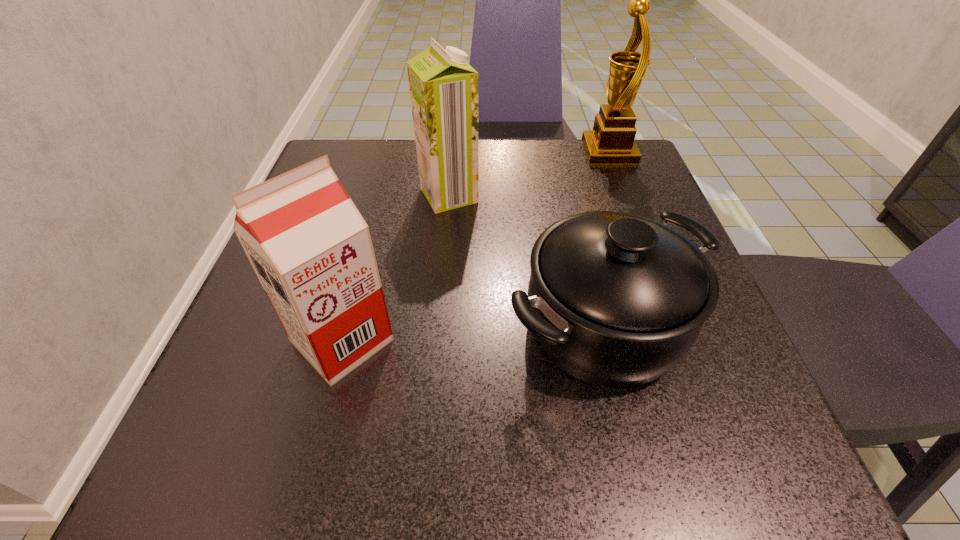
At what (x,y) coordinates should I click in order to perform the action: click on free space at the left edge. Please return your answer as a coordinate pair (x, y). Looking at the image, I should click on (229, 361).

The height and width of the screenshot is (540, 960). In the image, there is a desktop. Find the location of `free space at the near left corner`. free space at the near left corner is located at coordinates (289, 477).

What are the coordinates of `vacant space at the far right corner of the desktop` in the screenshot? It's located at (568, 143).

Where is `vacant space at the near right corner of the desktop`? The height and width of the screenshot is (540, 960). vacant space at the near right corner of the desktop is located at coordinates (710, 472).

You are a GUI agent. You are given a task and a screenshot of the screen. Output one action in this format:
    pyautogui.click(x=<x>, y=<y>)
    Task: Click on the free space between the third nearest object and the farthest object
    The image size is (960, 540).
    Given the screenshot: What is the action you would take?
    pyautogui.click(x=529, y=174)

Identify the location of vacant area that lies between the farthest object and the right soya milk. (529, 174).

Locate an element on the screen. unoccupied area between the award and the nearer soya milk is located at coordinates (475, 246).

Locate an element on the screen. The image size is (960, 540). free space between the leftmost object and the saucepan is located at coordinates (472, 333).

Locate an element on the screen. This screenshot has height=540, width=960. free space between the right soya milk and the award is located at coordinates (x=529, y=174).

Image resolution: width=960 pixels, height=540 pixels. Find the location of `vacant space that is in between the shortest object and the right soya milk`. vacant space that is in between the shortest object and the right soya milk is located at coordinates (526, 260).